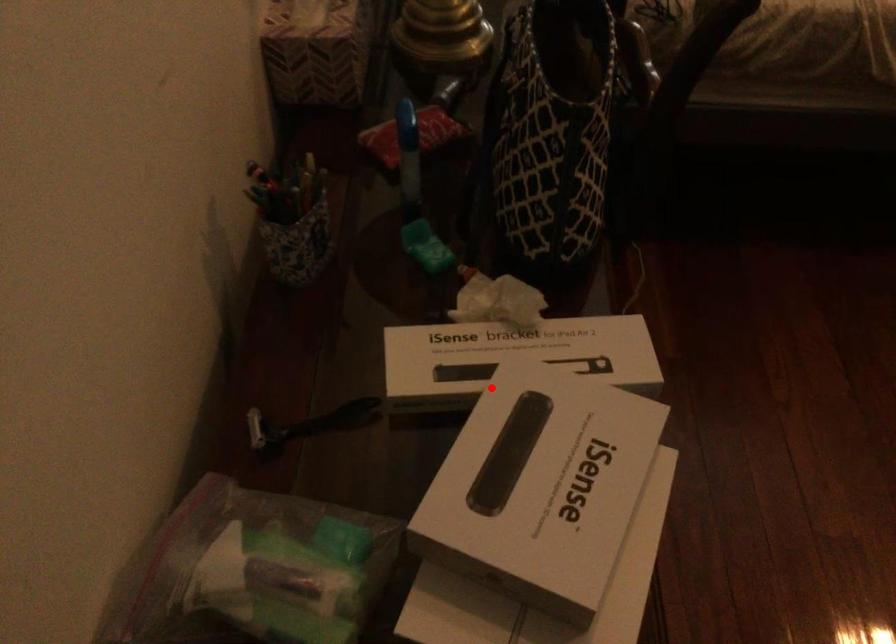
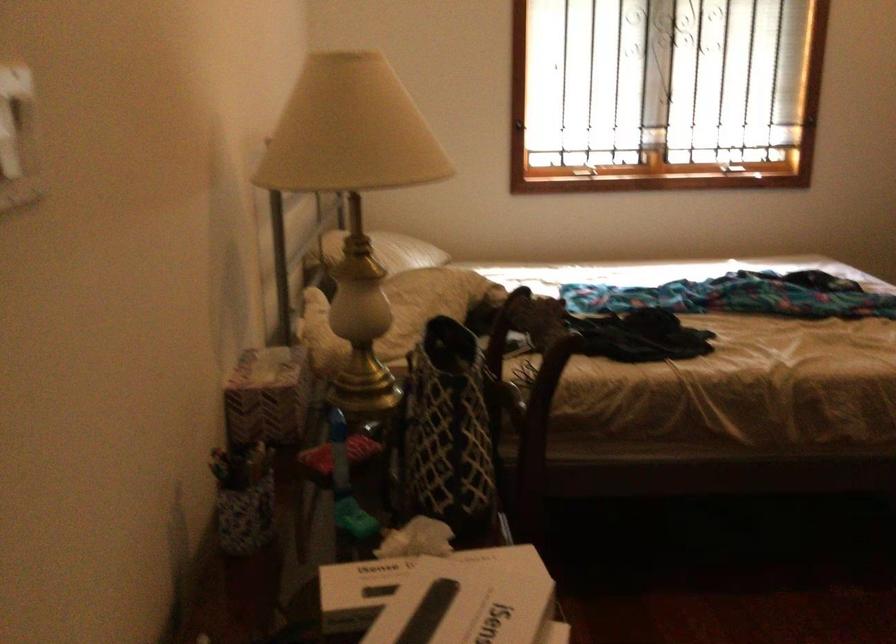
Locate, in the second image, the point that corresponds to the highlighted location in the first image.

(407, 583)